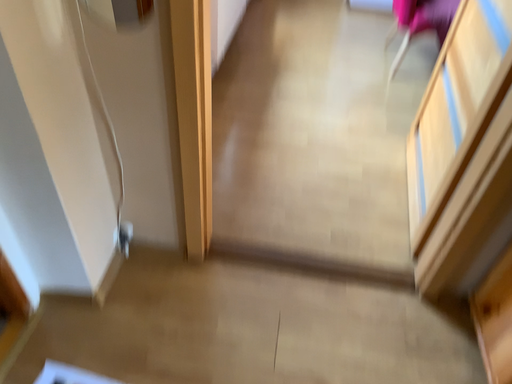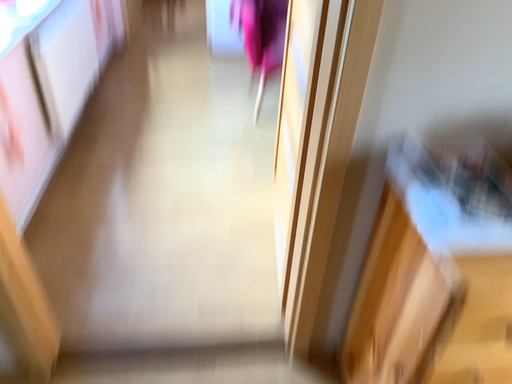
Question: Which way did the camera rotate in the video?

Choices:
 (A) rotated right
 (B) rotated left

Answer: (A)